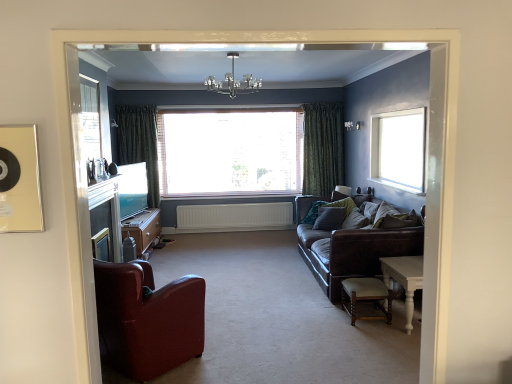
What do you see at coordinates (20, 180) in the screenshot?
I see `matte gold picture frame at left` at bounding box center [20, 180].

Describe the element at coordinates (352, 252) in the screenshot. This screenshot has width=512, height=384. I see `brown leather couch at center` at that location.

At what (x,y) coordinates should I click in order to perform the action: click on matte black entertainment center at left. Please return your answer as a coordinate pair (x, y). The image size is (512, 384). Looking at the image, I should click on (143, 229).

Is transparent glass window at center, the second window from the right, in contact with green textured curtain at left, which is counted as the second curtain, starting from the right?

No, transparent glass window at center, the second window from the right, is not in contact with green textured curtain at left, which is counted as the second curtain, starting from the right.

I want to click on the 2nd curtain in front of the transparent glass window at center, the 1th window positioned from the back, so click(139, 143).

Would you say transparent glass window at center, placed as the 1th window when sorted from left to right, contains green textured curtain at left, positioned as the first curtain in left-to-right order?

No, green textured curtain at left, positioned as the first curtain in left-to-right order, is located outside of transparent glass window at center, placed as the 1th window when sorted from left to right.

In terms of height, does transparent glass window at center, placed as the 1th window when sorted from left to right, look taller or shorter compared to green textured curtain at left, which is counted as the second curtain, starting from the right?

In the image, transparent glass window at center, placed as the 1th window when sorted from left to right, appears to be shorter than green textured curtain at left, which is counted as the second curtain, starting from the right.

In the scene shown: Is teal fabric pillow at right, marked as the first pillow in a back-to-front arrangement, facing away from white matte radiator at center?

No, teal fabric pillow at right, marked as the first pillow in a back-to-front arrangement, is not facing the opposite direction of white matte radiator at center.

Is teal fabric pillow at right, marked as the first pillow in a back-to-front arrangement, situated inside white matte radiator at center or outside?

teal fabric pillow at right, marked as the first pillow in a back-to-front arrangement, cannot be found inside white matte radiator at center.

Between teal fabric pillow at right, marked as the first pillow in a back-to-front arrangement, and white matte radiator at center, which one has smaller width?

white matte radiator at center.

Find the location of a particular element. radiator below the teal fabric pillow at right, marked as the first pillow in a back-to-front arrangement (from a real-world perspective) is located at coordinates (234, 215).

Which object is positioned more to the right, matte gold picture frame at left or green textured curtain at left, positioned as the first curtain in left-to-right order?

matte gold picture frame at left is more to the right.

Can you confirm if matte gold picture frame at left is bigger than green textured curtain at left, which is counted as the second curtain, starting from the right?

No, matte gold picture frame at left is not bigger than green textured curtain at left, which is counted as the second curtain, starting from the right.

Considering the points (34, 213) and (152, 113), which point is behind, point (34, 213) or point (152, 113)?

Positioned behind is point (152, 113).

In terms of size, does textured gray pillow at right, which is counted as the second pillow, starting from the front, appear bigger or smaller than clear glass window at upper right, the second window in the left-to-right sequence?

Considering their sizes, textured gray pillow at right, which is counted as the second pillow, starting from the front, takes up less space than clear glass window at upper right, the second window in the left-to-right sequence.

From a real-world perspective, is textured gray pillow at right, the second pillow viewed from the back, over clear glass window at upper right, the second window in the left-to-right sequence?

Incorrect, from a real-world perspective, textured gray pillow at right, the second pillow viewed from the back, is lower than clear glass window at upper right, the second window in the left-to-right sequence.

How much distance is there between textured gray pillow at right, which is counted as the second pillow, starting from the front, and clear glass window at upper right, which ranks as the second window in back-to-front order?

The distance of textured gray pillow at right, which is counted as the second pillow, starting from the front, from clear glass window at upper right, which ranks as the second window in back-to-front order, is 39.05 inches.

Considering the sizes of textured gray pillow at right, which is counted as the second pillow, starting from the front, and clear glass window at upper right, the second window in the left-to-right sequence, in the image, is textured gray pillow at right, which is counted as the second pillow, starting from the front, wider or thinner than clear glass window at upper right, the second window in the left-to-right sequence,?

Clearly, textured gray pillow at right, which is counted as the second pillow, starting from the front, has more width compared to clear glass window at upper right, the second window in the left-to-right sequence.

Which is nearer, (131, 106) or (10, 223)?

Clearly, point (131, 106) is more distant from the camera than point (10, 223).

Is green textured curtain at left, which is counted as the second curtain, starting from the right, bigger or smaller than matte gold picture frame at left?

Clearly, green textured curtain at left, which is counted as the second curtain, starting from the right, is larger in size than matte gold picture frame at left.

Is matte gold picture frame at left surrounded by green textured curtain at left, positioned as the first curtain in left-to-right order?

That's incorrect, matte gold picture frame at left is not inside green textured curtain at left, positioned as the first curtain in left-to-right order.

How distant is green textured curtain at left, positioned as the first curtain in left-to-right order, from matte gold picture frame at left?

5.61 meters.

Is green textured curtain at left, positioned as the first curtain in left-to-right order, turned away from white wood table at lower right?

No.

How many degrees apart are the facing directions of green textured curtain at left, which is counted as the second curtain, starting from the right, and white wood table at lower right?

The angular difference between green textured curtain at left, which is counted as the second curtain, starting from the right, and white wood table at lower right is 88.4 degrees.

Which is nearer, (116, 115) or (393, 276)?

Point (116, 115) is positioned farther from the camera compared to point (393, 276).

Could white wood table at lower right be considered to be inside green textured curtain at left, positioned as the first curtain in left-to-right order?

Actually, white wood table at lower right is outside green textured curtain at left, positioned as the first curtain in left-to-right order.

Considering the relative sizes of brown leather couch at center and clear glass window at upper right, which is the first window in right-to-left order, in the image provided, is brown leather couch at center taller than clear glass window at upper right, which is the first window in right-to-left order,?

Correct, brown leather couch at center is much taller as clear glass window at upper right, which is the first window in right-to-left order.

Consider the image. Is brown leather couch at center bigger or smaller than clear glass window at upper right, positioned as the first window in front-to-back order?

Considering their sizes, brown leather couch at center takes up more space than clear glass window at upper right, positioned as the first window in front-to-back order.

From a real-world perspective, who is located higher, brown leather couch at center or clear glass window at upper right, which is the first window in right-to-left order?

clear glass window at upper right, which is the first window in right-to-left order.

Considering the positions of objects brown leather couch at center and clear glass window at upper right, positioned as the first window in front-to-back order, in the image provided, who is behind, brown leather couch at center or clear glass window at upper right, positioned as the first window in front-to-back order,?

clear glass window at upper right, positioned as the first window in front-to-back order.

The width and height of the screenshot is (512, 384). Identify the location of window located behind the green textured curtain at left, which is counted as the second curtain, starting from the right. (230, 152).

Where is `radiator lying below the teal fabric pillow at right, marked as the first pillow in a back-to-front arrangement (from the image's perspective)`? The height and width of the screenshot is (384, 512). radiator lying below the teal fabric pillow at right, marked as the first pillow in a back-to-front arrangement (from the image's perspective) is located at coordinates (234, 215).

Which object lies nearer to the anchor point light beige leather stool at lower right, textured gray pillow at right, the second pillow viewed from the back, or textured gray pillow at right, the 1th pillow in the front-to-back sequence?

The object closer to light beige leather stool at lower right is textured gray pillow at right, the 1th pillow in the front-to-back sequence.

Based on their spatial positions, is matte gold picture frame at left or clear glass chandelier at upper center closer to teal fabric pillow at right, positioned as the 3th pillow in front-to-back order?

Based on the image, clear glass chandelier at upper center appears to be nearer to teal fabric pillow at right, positioned as the 3th pillow in front-to-back order.

Estimate the real-world distances between objects in this image. Which object is closer to textured gray pillow at right, the 1th pillow in the front-to-back sequence, clear glass window screen at upper left or transparent glass window at center, which is the second window from front to back?

transparent glass window at center, which is the second window from front to back, is closer to textured gray pillow at right, the 1th pillow in the front-to-back sequence.

When comparing their distances from green textured curtain at left, which is counted as the second curtain, starting from the right, does light beige leather stool at lower right or white matte radiator at center seem further?

Among the two, light beige leather stool at lower right is located further to green textured curtain at left, which is counted as the second curtain, starting from the right.

Based on their spatial positions, is brown leather couch at center or matte gold picture frame at left further from textured gray pillow at right, the 1th pillow in the front-to-back sequence?

matte gold picture frame at left is positioned further to the anchor textured gray pillow at right, the 1th pillow in the front-to-back sequence.

Based on their spatial positions, is transparent glass window at center, the second window from the right, or white wood table at lower right closer to leather armchair at left?

white wood table at lower right is closer to leather armchair at left.

Considering their positions, is green textured curtain at left, positioned as the first curtain in left-to-right order, positioned closer to matte gold picture frame at left than clear glass window screen at upper left?

Based on the image, clear glass window screen at upper left appears to be nearer to matte gold picture frame at left.

Which object lies further to the anchor point matte black entertainment center at left, clear glass window screen at upper left or brown leather couch at center?

brown leather couch at center is positioned further to the anchor matte black entertainment center at left.

The height and width of the screenshot is (384, 512). I want to click on table located between leather armchair at left and teal fabric pillow at right, positioned as the 3th pillow in front-to-back order, in the depth direction, so click(404, 279).

Locate an element on the screen. stool between leather armchair at left and brown leather couch at center from left to right is located at coordinates (366, 297).

What are the coordinates of `window screen located between matte gold picture frame at left and matte black entertainment center at left in the depth direction` in the screenshot? It's located at (91, 117).

You are a GUI agent. You are given a task and a screenshot of the screen. Output one action in this format:
    pyautogui.click(x=<x>, y=<y>)
    Task: Click on the studio couch between leather armchair at left and textured gray pillow at right, the 3th pillow in the back-to-front sequence
    Image resolution: width=512 pixels, height=384 pixels.
    Given the screenshot: What is the action you would take?
    pyautogui.click(x=352, y=252)